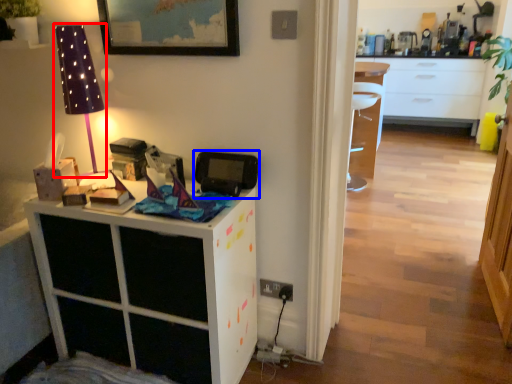
Question: Among these objects, which one is farthest to the camera, table lamp (highlighted by a red box) or appliance (highlighted by a blue box)?

Choices:
 (A) table lamp
 (B) appliance

Answer: (B)